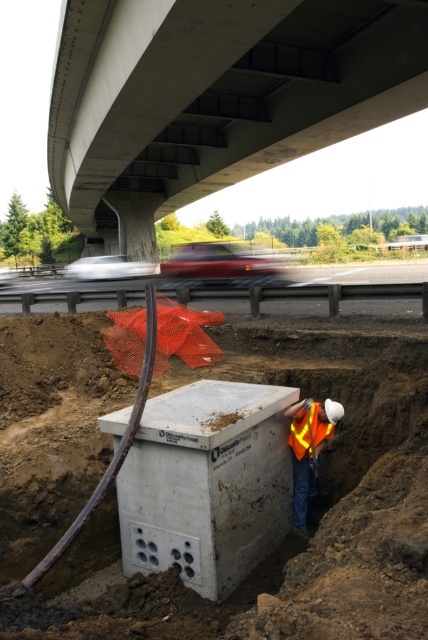
Question: Based on their relative distances, which object is farther from the concrete barrier at lower center?

Choices:
 (A) reflective fabric safety vest at center
 (B) reflective orange vest at center

Answer: (B)

Question: Does concrete at upper center have a smaller size compared to reflective orange vest at center?

Choices:
 (A) no
 (B) yes

Answer: (A)

Question: Is concrete barrier at lower center further to camera compared to reflective orange vest at center?

Choices:
 (A) no
 (B) yes

Answer: (B)

Question: Which object appears farthest from the camera in this image?

Choices:
 (A) concrete at upper center
 (B) reflective orange vest at center
 (C) concrete barrier at lower center

Answer: (C)

Question: Which point appears closest to the camera in this image?

Choices:
 (A) (288, 442)
 (B) (309, 477)
 (C) (113, 227)

Answer: (A)

Question: Can you confirm if concrete at upper center is positioned to the left of concrete barrier at lower center?

Choices:
 (A) yes
 (B) no

Answer: (B)